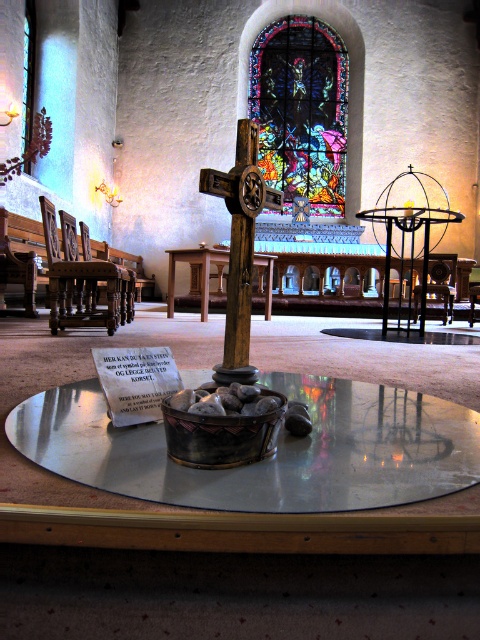
Who is lower down, wooden cross at center or dark brown wood chair at left?

wooden cross at center is below.

Is wooden cross at center wider than dark brown wood chair at left?

No, wooden cross at center is not wider than dark brown wood chair at left.

Find the location of `wooden cross at center`. wooden cross at center is located at coordinates (240, 246).

The image size is (480, 640). Find the location of `wooden cross at center`. wooden cross at center is located at coordinates (240, 246).

Which of these two, wooden polished bench at left or wooden chair at center, stands taller?

wooden chair at center

What are the coordinates of `wooden polished bench at left` in the screenshot? It's located at (22, 232).

Between point (226, 198) and point (140, 275), which one is positioned behind?

Point (140, 275)

Can you confirm if wooden cross at center is thinner than wooden polished bench at left?

No, wooden cross at center is not thinner than wooden polished bench at left.

Is point (228, 368) farther from camera compared to point (81, 256)?

No, it is in front of (81, 256).

The height and width of the screenshot is (640, 480). Identify the location of wooden cross at center. (240, 246).